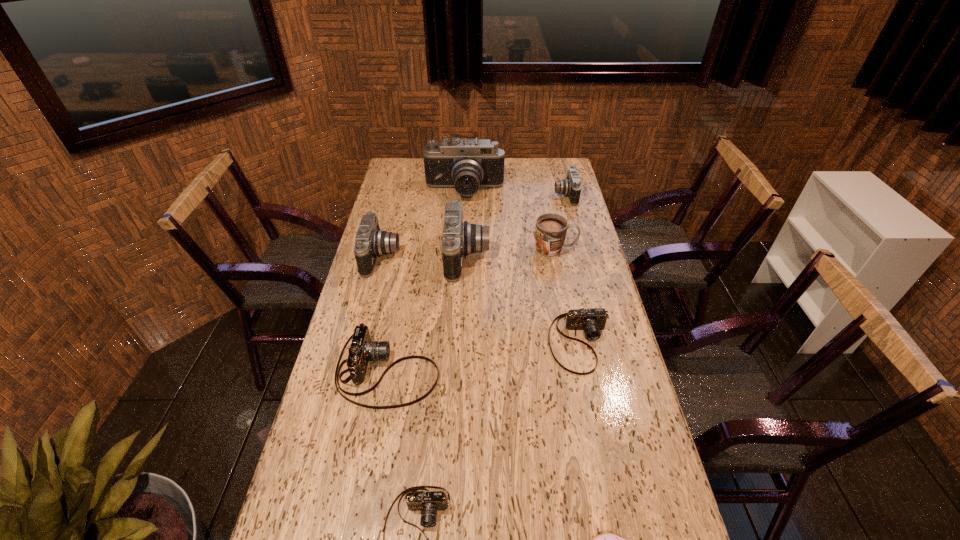
Locate an element on the screen. the biggest brown camera is located at coordinates tap(362, 350).

Identify the location of the rightmost brown camera. The width and height of the screenshot is (960, 540). (593, 320).

Identify the location of the second biggest brown camera. (593, 320).

I want to click on blank space located on the front-facing side of the tallest object, so click(x=464, y=212).

This screenshot has height=540, width=960. In order to click on vacant space located 0.220m on the front-facing side of the sixth shortest camera in this screenshot , I will do `click(547, 256)`.

Where is `vacant space located 0.090m on the front-facing side of the leftmost black camera`? This screenshot has width=960, height=540. vacant space located 0.090m on the front-facing side of the leftmost black camera is located at coordinates (422, 256).

The height and width of the screenshot is (540, 960). In order to click on vacant space situated on the side of the mug with the handle in this screenshot , I will do 592,249.

Where is `free spot located on the front-facing side of the fourth shortest camera`? This screenshot has height=540, width=960. free spot located on the front-facing side of the fourth shortest camera is located at coordinates (476, 195).

What are the coordinates of `vacant region located 0.290m on the front-facing side of the fourth shortest camera` in the screenshot? It's located at (490, 195).

I want to click on vacant point located on the front-facing side of the fourth shortest camera, so click(x=523, y=195).